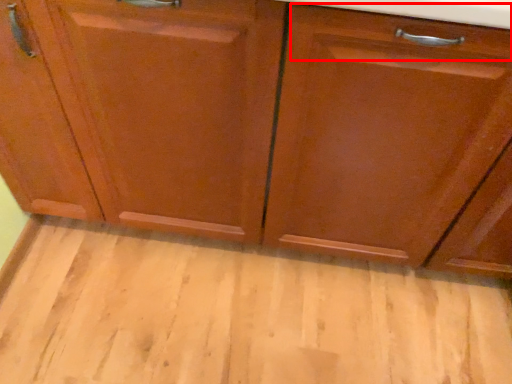
Question: Considering the relative positions of drawer (annotated by the red box) and plain in the image provided, where is drawer (annotated by the red box) located with respect to the staircase?

Choices:
 (A) right
 (B) left

Answer: (A)